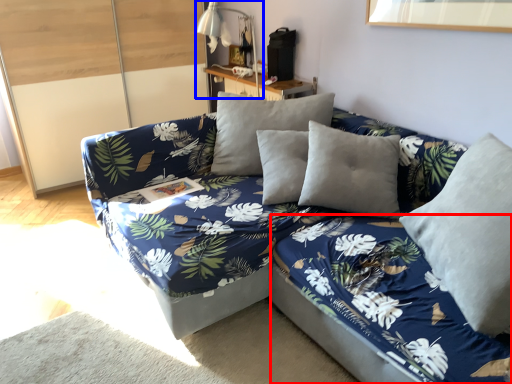
Question: Which point is closer to the camera, bed frame (highlighted by a red box) or table lamp (highlighted by a blue box)?

Choices:
 (A) bed frame
 (B) table lamp

Answer: (A)